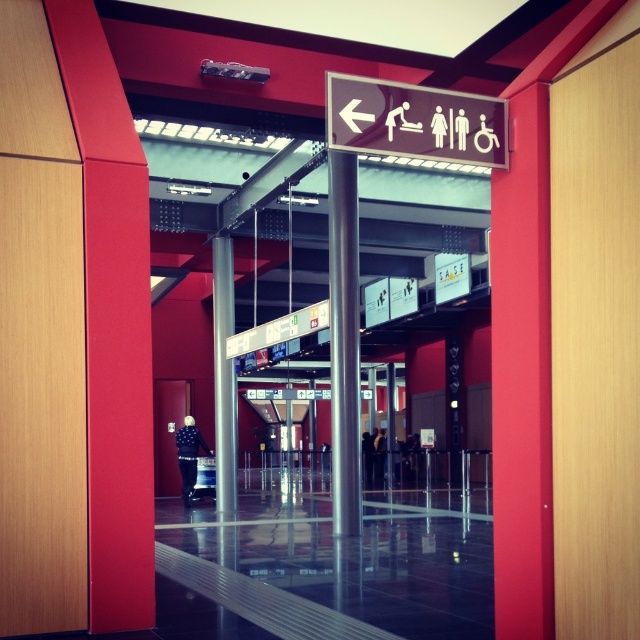
Question: Considering the relative positions of metallic pole at center and metallic silver pole at center in the image provided, where is metallic pole at center located with respect to metallic silver pole at center?

Choices:
 (A) right
 (B) left

Answer: (A)

Question: Which object is the farthest from the metallic silver pole at center?

Choices:
 (A) metallic pole at center
 (B) brown plastic sign at upper center

Answer: (B)

Question: Estimate the real-world distances between objects in this image. Which object is closer to the brown plastic sign at upper center?

Choices:
 (A) metallic silver pole at center
 (B) metallic pole at center

Answer: (B)

Question: Is metallic pole at center to the left of metallic silver pole at center from the viewer's perspective?

Choices:
 (A) no
 (B) yes

Answer: (A)

Question: Which of the following is the farthest from the observer?

Choices:
 (A) metallic pole at center
 (B) brown plastic sign at upper center

Answer: (A)

Question: Is brown plastic sign at upper center smaller than metallic pole at center?

Choices:
 (A) no
 (B) yes

Answer: (B)